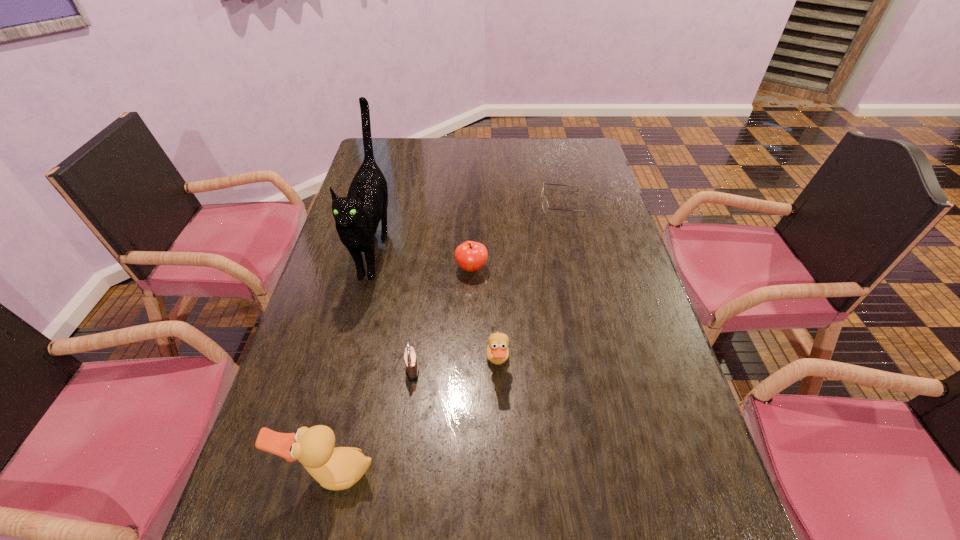
Identify the location of object located at the near left corner. pos(339,468).

What are the coordinates of `vacant space at the far edge of the desktop` in the screenshot? It's located at (509, 139).

The width and height of the screenshot is (960, 540). I want to click on free space at the near edge of the desktop, so click(x=477, y=480).

Locate an element on the screen. The width and height of the screenshot is (960, 540). free region at the left edge of the desktop is located at coordinates (300, 333).

Find the location of a particular element. free space at the right edge is located at coordinates (580, 268).

Identify the location of vacant space at the far right corner. Image resolution: width=960 pixels, height=540 pixels. (573, 140).

Locate an element on the screen. Image resolution: width=960 pixels, height=540 pixels. empty space between the cat and the spectacles is located at coordinates (468, 226).

The width and height of the screenshot is (960, 540). In order to click on unoccupied position between the apple and the rightmost object in this screenshot , I will do `click(516, 236)`.

You are a GUI agent. You are given a task and a screenshot of the screen. Output one action in this format:
    pyautogui.click(x=<x>, y=<y>)
    Task: Click on the free point between the padlock and the spectacles
    Image resolution: width=960 pixels, height=540 pixels.
    Given the screenshot: What is the action you would take?
    pyautogui.click(x=487, y=287)

Identify the location of vacant space that is in between the nearer duck and the right duck. This screenshot has height=540, width=960. (415, 418).